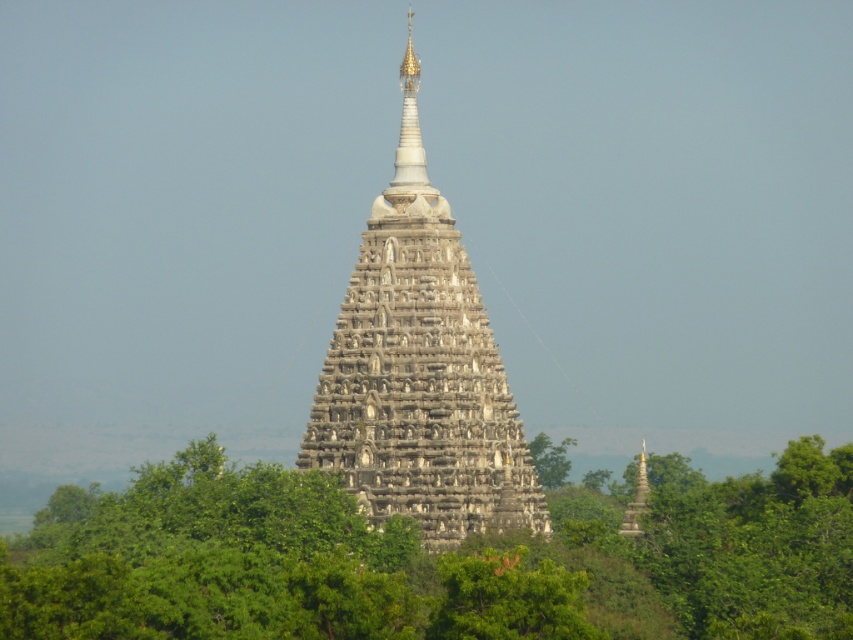
Question: Which object is farther from the camera taking this photo?

Choices:
 (A) white polished stupa at center
 (B) green leafy tree at center
 (C) green leafy trees at center
 (D) gray stone pagoda at center

Answer: (B)

Question: Among these points, which one is nearest to the camera?

Choices:
 (A) (390, 337)
 (B) (560, 460)
 (C) (763, 513)
 (D) (408, 172)

Answer: (A)

Question: Can you confirm if gray stone pagoda at center is positioned to the right of white polished stupa at center?

Choices:
 (A) yes
 (B) no

Answer: (B)

Question: Is gray stone pagoda at center thinner than green leafy tree at center?

Choices:
 (A) yes
 (B) no

Answer: (B)

Question: Does white polished stupa at center appear on the right side of green leafy tree at center?

Choices:
 (A) no
 (B) yes

Answer: (A)

Question: Which of these objects is positioned closest to the white polished stupa at center?

Choices:
 (A) gray stone pagoda at center
 (B) green leafy tree at center

Answer: (A)